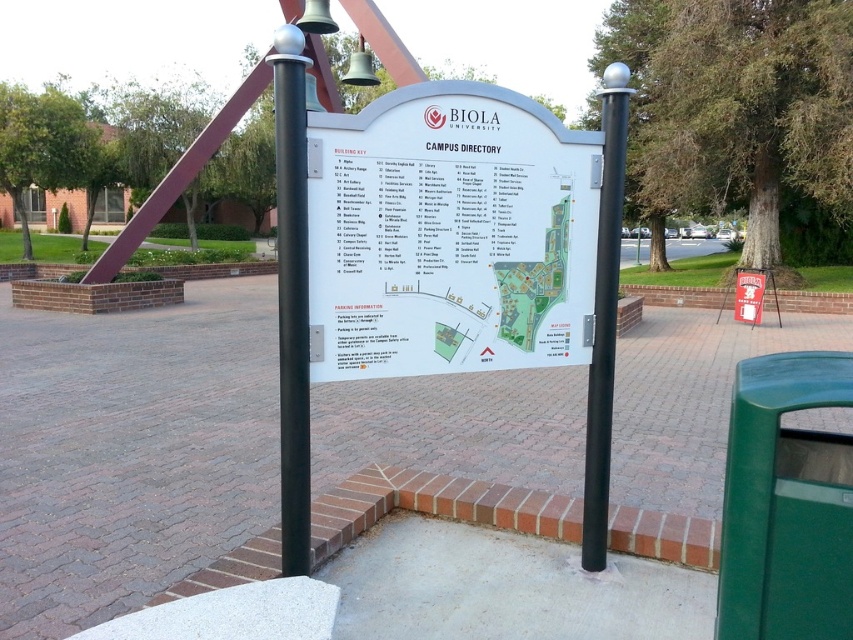
You are a visitor holding a 1.0 meter wide backpack. You need to walk between the white plastic sign at center and the black polished metal pole at center. Can your backpack fit through the space between them?

The white plastic sign at center and black polished metal pole at center are 1.12 meters apart. Since your backpack is 1.0 meters wide, it can fit through the space between them as the distance is wider than the backpack.

You are standing in front of the Biola University campus directory sign. You notice two points marked on the map at coordinates point (369,282) and point (611,138). Which point is closer to your current position?

Point (369,282) is closer to the viewer than point (611,138), so the point closer to your current position is point (369,282).